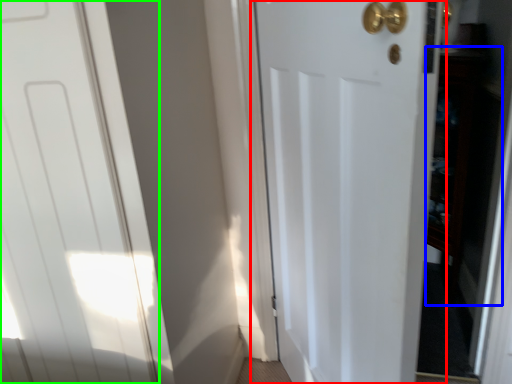
Question: Based on their relative distances, which object is nearer to door (highlighted by a red box)? Choose from cabinetry (highlighted by a blue box) and door (highlighted by a green box).

Choices:
 (A) cabinetry
 (B) door

Answer: (B)